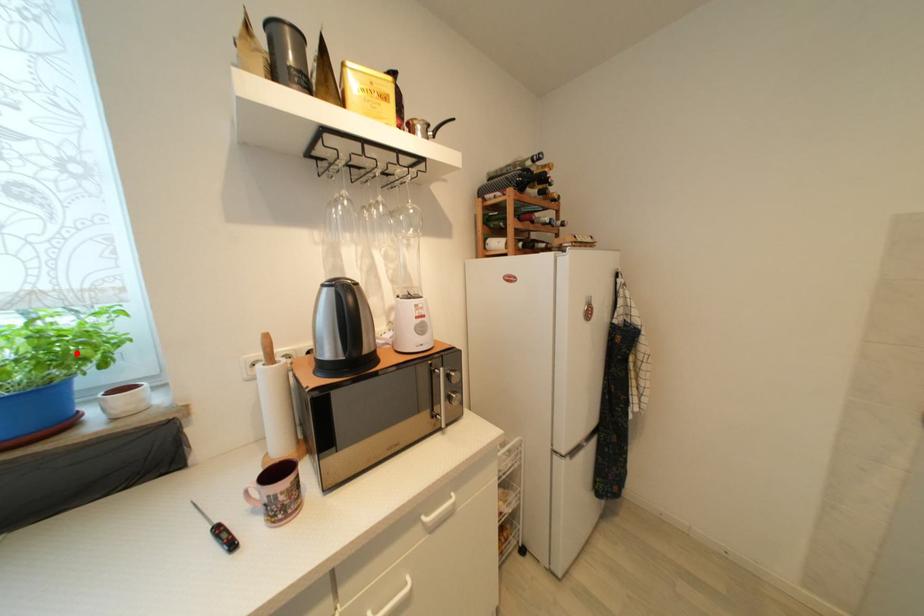
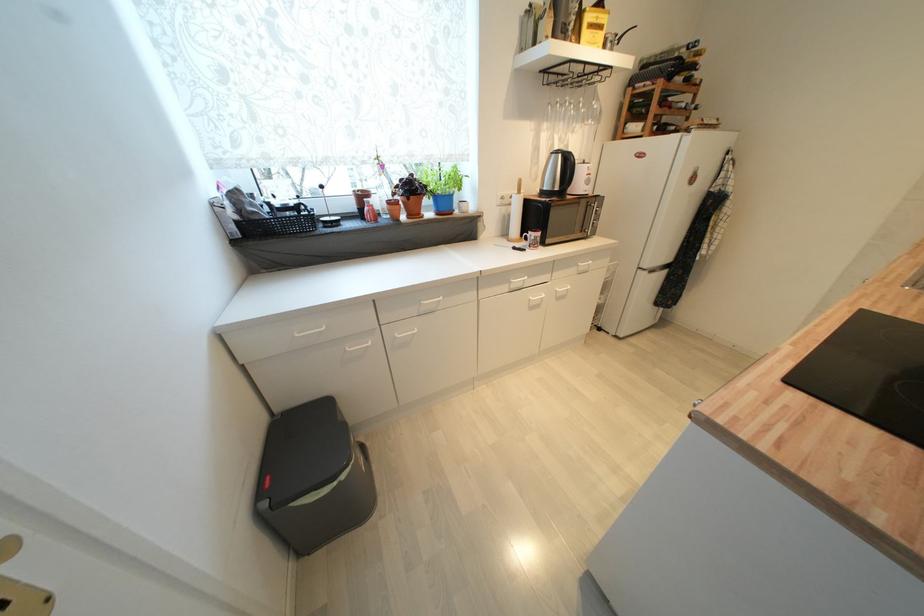
The point at the highlighted location is marked in the first image. Where is the corresponding point in the second image?

(463, 184)